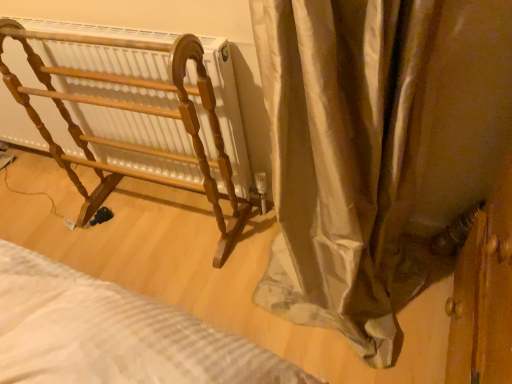
Question: Should I look upward or downward to see silky beige curtain at center?

Choices:
 (A) up
 (B) down

Answer: (A)

Question: Is wooden rack at left at the right side of silky beige curtain at center?

Choices:
 (A) yes
 (B) no

Answer: (B)

Question: Considering the relative sizes of wooden rack at left and silky beige curtain at center in the image provided, is wooden rack at left smaller than silky beige curtain at center?

Choices:
 (A) no
 (B) yes

Answer: (B)

Question: Is the depth of wooden rack at left greater than that of silky beige curtain at center?

Choices:
 (A) yes
 (B) no

Answer: (A)

Question: Does wooden rack at left have a lesser height compared to silky beige curtain at center?

Choices:
 (A) yes
 (B) no

Answer: (A)

Question: From a real-world perspective, is wooden rack at left under silky beige curtain at center?

Choices:
 (A) yes
 (B) no

Answer: (A)

Question: Considering the relative sizes of wooden rack at left and silky beige curtain at center in the image provided, is wooden rack at left taller than silky beige curtain at center?

Choices:
 (A) no
 (B) yes

Answer: (A)

Question: Does silky beige curtain at center have a lesser height compared to wooden rack at left?

Choices:
 (A) yes
 (B) no

Answer: (B)

Question: Is silky beige curtain at center in contact with wooden rack at left?

Choices:
 (A) yes
 (B) no

Answer: (B)

Question: Considering the relative sizes of silky beige curtain at center and wooden rack at left in the image provided, is silky beige curtain at center thinner than wooden rack at left?

Choices:
 (A) no
 (B) yes

Answer: (A)

Question: Considering the relative sizes of silky beige curtain at center and wooden rack at left in the image provided, is silky beige curtain at center bigger than wooden rack at left?

Choices:
 (A) yes
 (B) no

Answer: (A)

Question: Is silky beige curtain at center turned away from wooden rack at left?

Choices:
 (A) yes
 (B) no

Answer: (B)

Question: Is wooden rack at left a part of silky beige curtain at center?

Choices:
 (A) no
 (B) yes

Answer: (A)

Question: Does point (155, 117) appear closer or farther from the camera than point (410, 279)?

Choices:
 (A) farther
 (B) closer

Answer: (A)